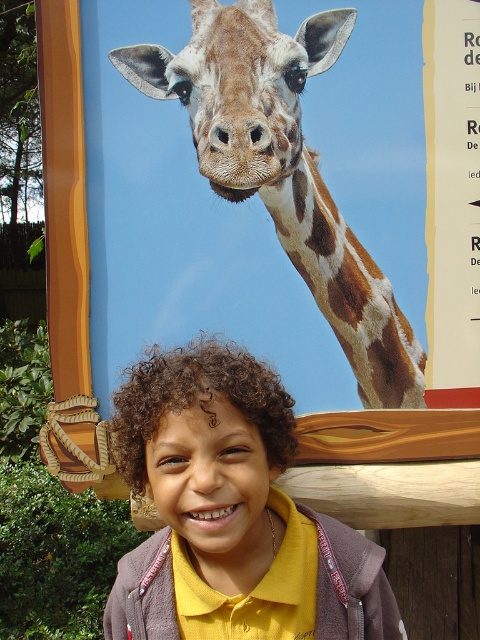
Between curly-haired child at center and brown spotted skin at upper center, which one appears on the right side from the viewer's perspective?

From the viewer's perspective, brown spotted skin at upper center appears more on the right side.

Who is higher up, curly-haired child at center or brown spotted skin at upper center?

brown spotted skin at upper center

I want to click on curly-haired child at center, so pyautogui.click(x=230, y=513).